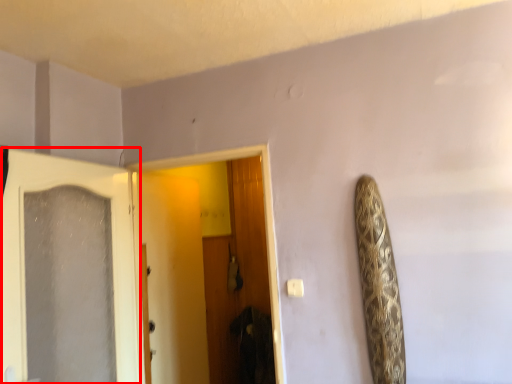
Question: From the image, what is the correct spatial relationship of door (annotated by the red box) in relation to door?

Choices:
 (A) right
 (B) left

Answer: (B)